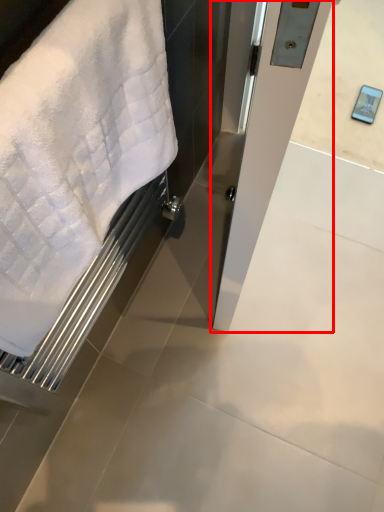
Question: Considering the relative positions of screen door (annotated by the red box) and towel in the image provided, where is screen door (annotated by the red box) located with respect to the staircase?

Choices:
 (A) left
 (B) right

Answer: (B)